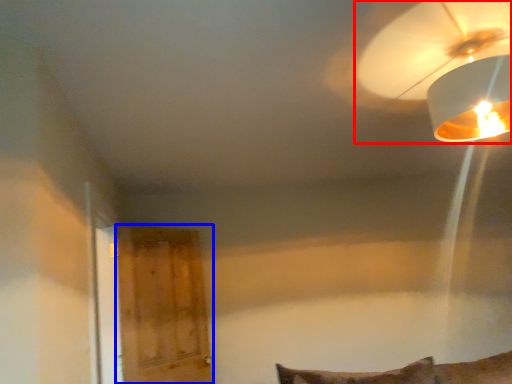
Question: Which point is further to the camera, lamp (highlighted by a red box) or glass door (highlighted by a blue box)?

Choices:
 (A) lamp
 (B) glass door

Answer: (B)